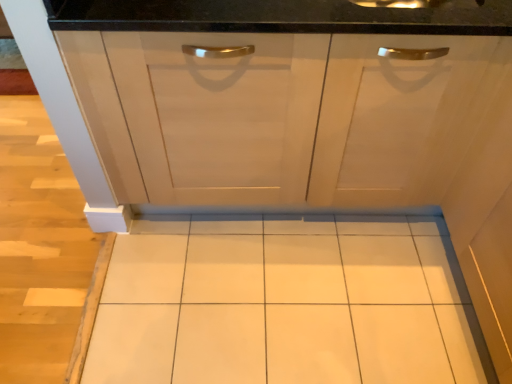
Question: Considering the relative sizes of matte white cabinet at center and white glossy tile at center in the image provided, is matte white cabinet at center wider than white glossy tile at center?

Choices:
 (A) no
 (B) yes

Answer: (A)

Question: Is the position of matte white cabinet at center less distant than that of white glossy tile at center?

Choices:
 (A) yes
 (B) no

Answer: (A)

Question: Is matte white cabinet at center thinner than white glossy tile at center?

Choices:
 (A) no
 (B) yes

Answer: (B)

Question: Are matte white cabinet at center and white glossy tile at center beside each other?

Choices:
 (A) no
 (B) yes

Answer: (A)

Question: Considering the relative positions of matte white cabinet at center and white glossy tile at center in the image provided, is matte white cabinet at center to the left of white glossy tile at center from the viewer's perspective?

Choices:
 (A) yes
 (B) no

Answer: (B)

Question: Is matte white cabinet at center not near white glossy tile at center?

Choices:
 (A) yes
 (B) no

Answer: (B)

Question: From a real-world perspective, is white glossy tile at center physically below matte white cabinet at center?

Choices:
 (A) no
 (B) yes

Answer: (B)

Question: Considering the relative positions of white glossy tile at center and matte white cabinet at center in the image provided, is white glossy tile at center in front of matte white cabinet at center?

Choices:
 (A) no
 (B) yes

Answer: (A)

Question: Is white glossy tile at center further to the viewer compared to matte white cabinet at center?

Choices:
 (A) no
 (B) yes

Answer: (B)

Question: Is white glossy tile at center far away from matte white cabinet at center?

Choices:
 (A) yes
 (B) no

Answer: (B)

Question: Is white glossy tile at center wider than matte white cabinet at center?

Choices:
 (A) no
 (B) yes

Answer: (B)

Question: Could matte white cabinet at center be considered to be inside white glossy tile at center?

Choices:
 (A) yes
 (B) no

Answer: (B)

Question: From the image's perspective, is matte white cabinet at center above or below white glossy tile at center?

Choices:
 (A) below
 (B) above

Answer: (B)